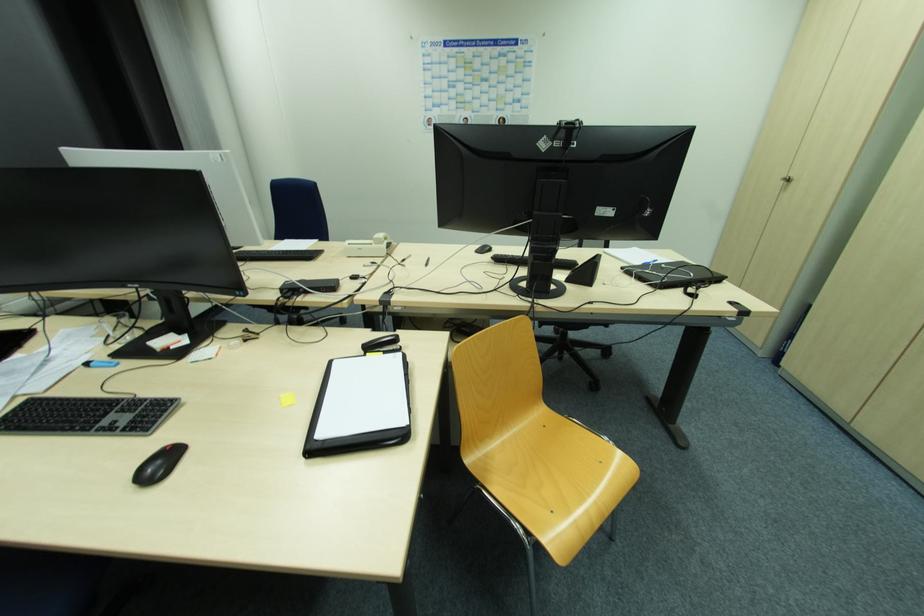
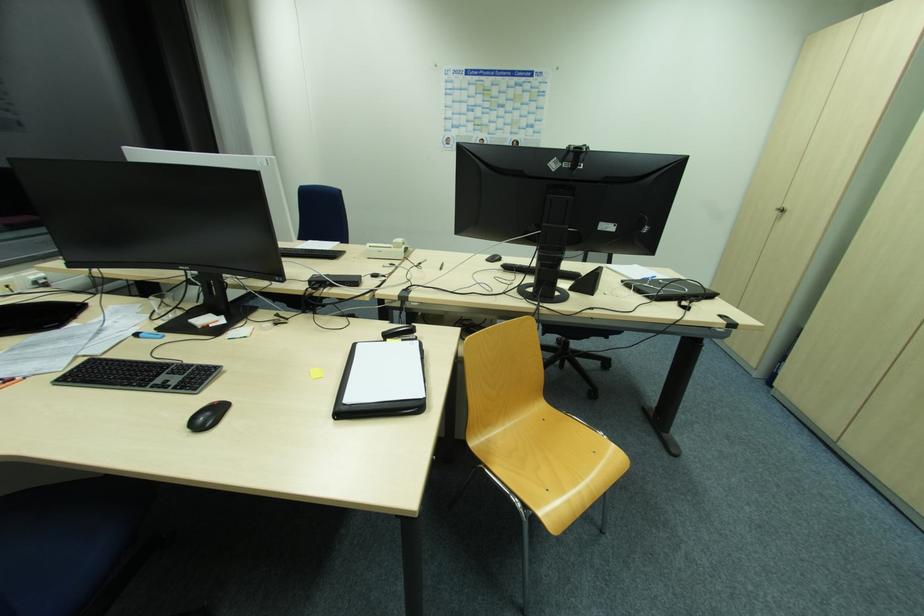
The point at (548,138) is marked in the first image. Where is the corresponding point in the second image?

(557, 159)